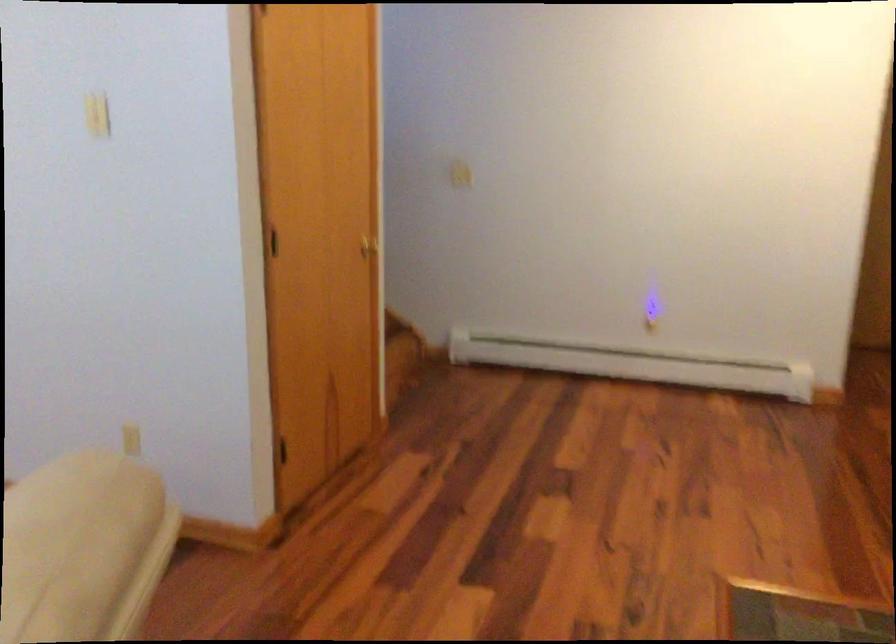
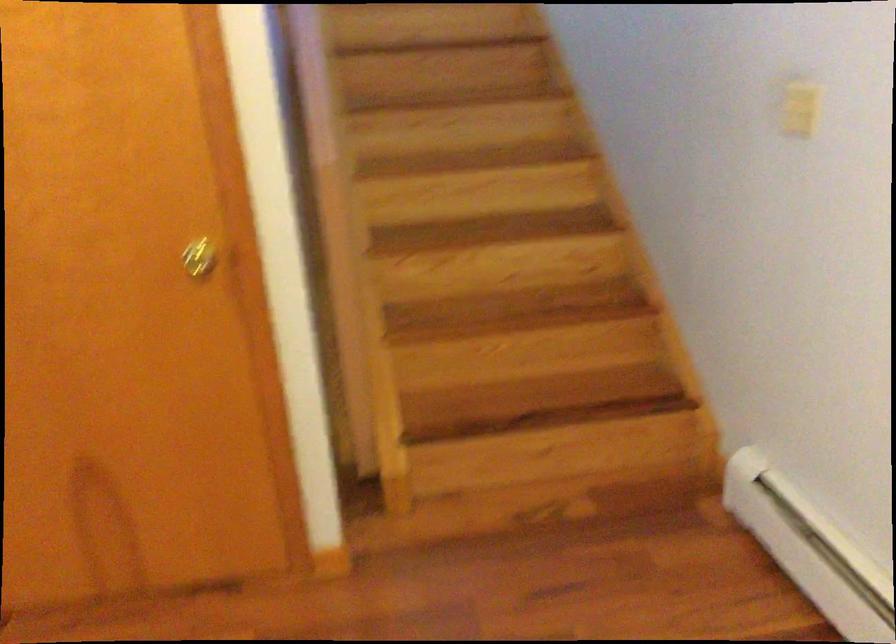
Question: Which direction would the cameraman need to move to produce the second image? Reply with the corresponding letter.

Choices:
 (A) Left
 (B) Right
 (C) Forward
 (D) Backward

Answer: (D)